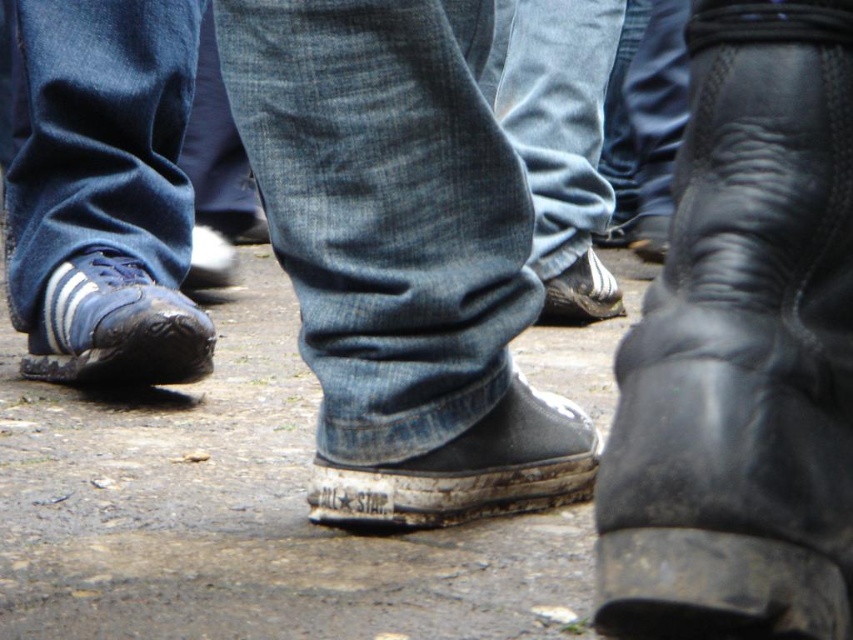
Question: Can you confirm if black leather boot at right is positioned below blue suede sneaker at left?

Choices:
 (A) yes
 (B) no

Answer: (A)

Question: Estimate the real-world distances between objects in this image. Which object is closer to the dull concrete pavement at center?

Choices:
 (A) blue denim jeans at left
 (B) denim jeans at center
 (C) black leather shoe at center
 (D) black leather boot at right

Answer: (C)

Question: Which object appears farthest from the camera in this image?

Choices:
 (A) denim at left
 (B) dull concrete pavement at center
 (C) white leather shoe at center

Answer: (C)

Question: From the image, what is the correct spatial relationship of dull concrete pavement at center in relation to black leather shoe at center?

Choices:
 (A) right
 (B) left

Answer: (B)

Question: Does denim jeans at center have a smaller size compared to blue suede sneaker at left?

Choices:
 (A) yes
 (B) no

Answer: (B)

Question: Among these points, which one is farthest from the camera?

Choices:
 (A) (573, 35)
 (B) (268, 634)

Answer: (A)